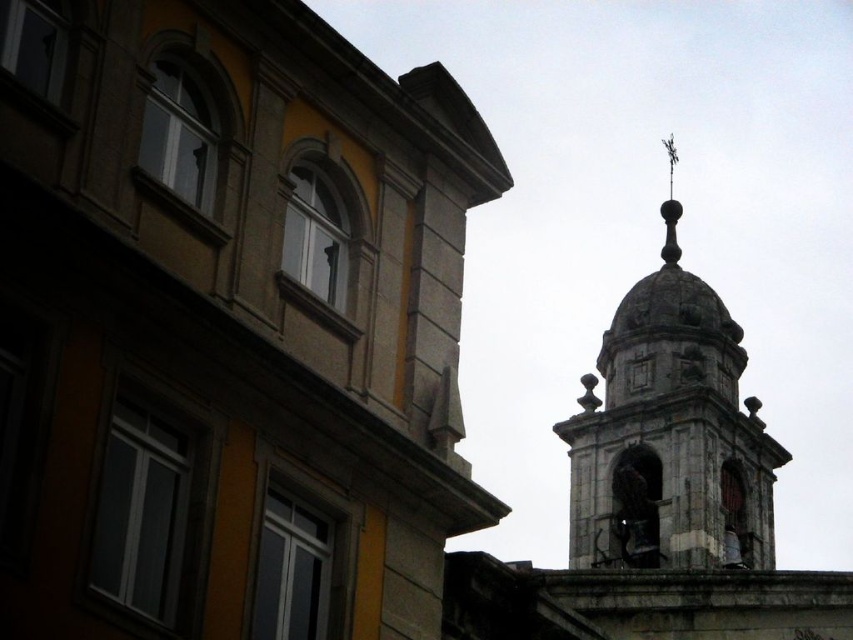
You are an architect analyzing the skyline of this city. You observe the dark gray stone bell tower at upper right and the polished metal spire at upper center. Which structure would cast a longer shadow during midday when the sun is directly overhead?

The dark gray stone bell tower at upper right is taller than the polished metal spire at upper center, so it would cast a longer shadow during midday when the sun is directly overhead.

You are an architect analyzing the image. You notice the dark gray stone bell tower at upper right and the polished metal spire at upper center. Which of these two structures is positioned closer to your viewpoint?

The dark gray stone bell tower at upper right is closer to the viewer than the polished metal spire at upper center.